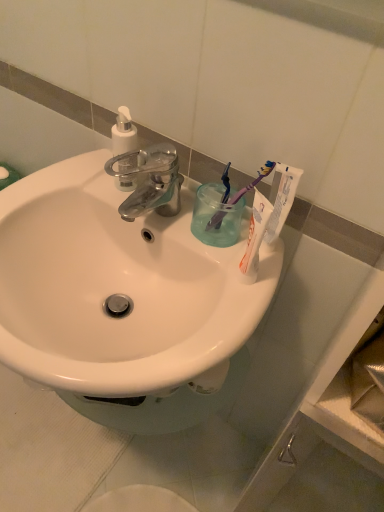
I want to click on vacant space in front of transparent plastic cup at upper right, so click(x=221, y=295).